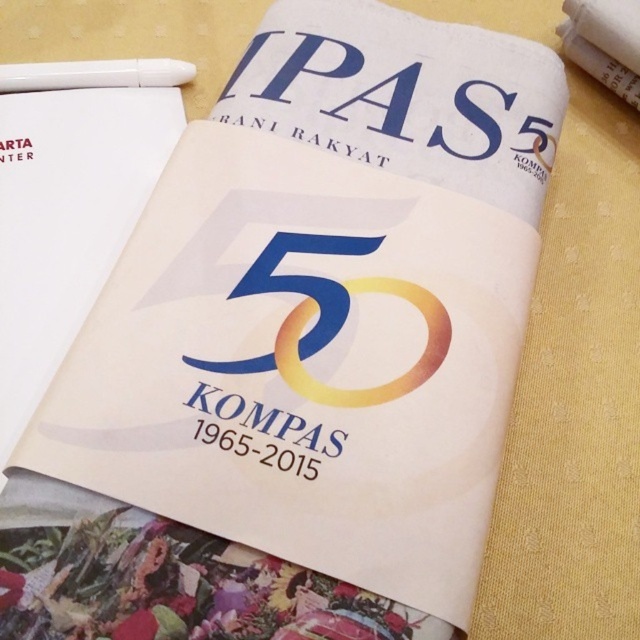
Does blue glossy number at center have a lesser height compared to white plastic pen at upper left?

No, blue glossy number at center is not shorter than white plastic pen at upper left.

This screenshot has height=640, width=640. Describe the element at coordinates (330, 321) in the screenshot. I see `blue glossy number at center` at that location.

The image size is (640, 640). What do you see at coordinates (330, 321) in the screenshot?
I see `blue glossy number at center` at bounding box center [330, 321].

Identify the location of blue glossy number at center. This screenshot has width=640, height=640. (330, 321).